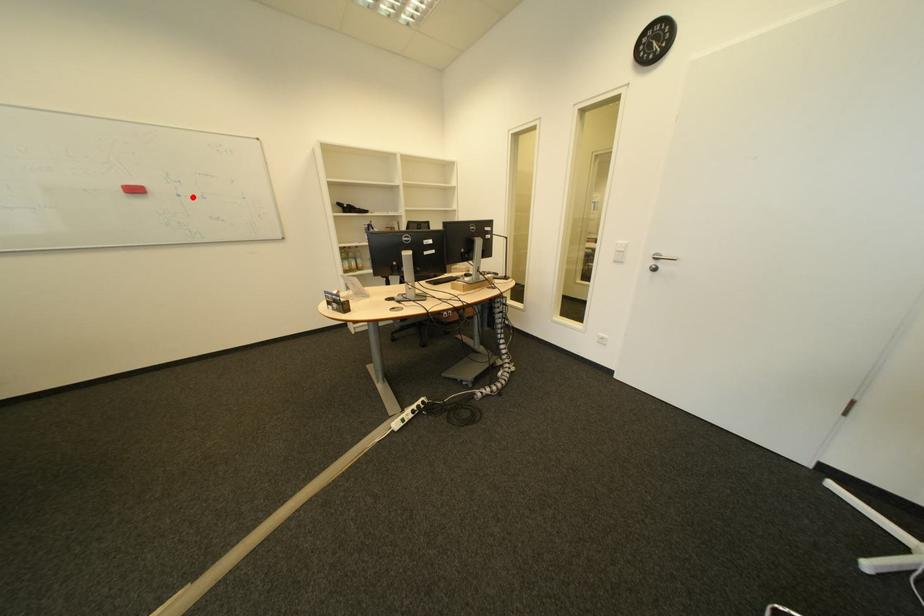
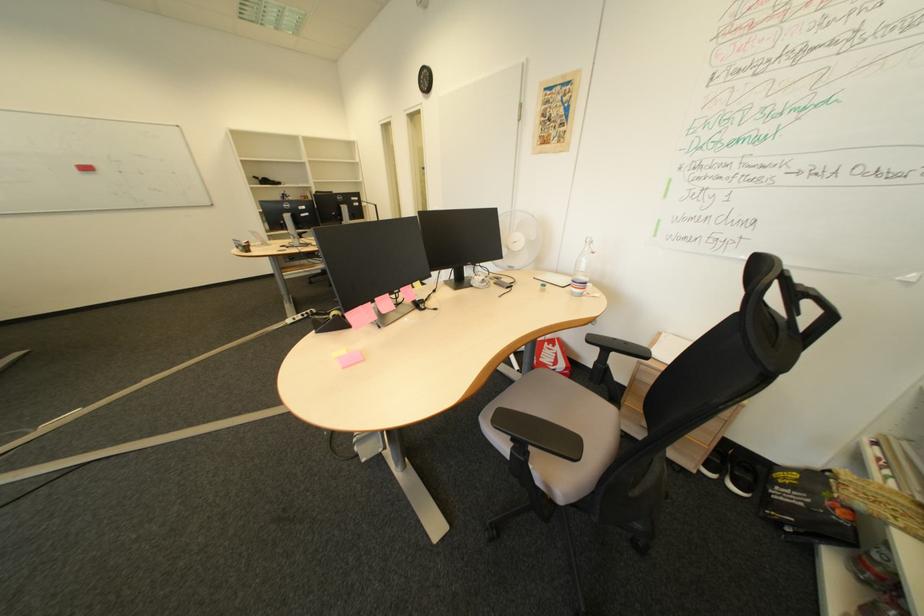
In the second image, find the point that corresponds to the highlighted location in the first image.

(135, 174)